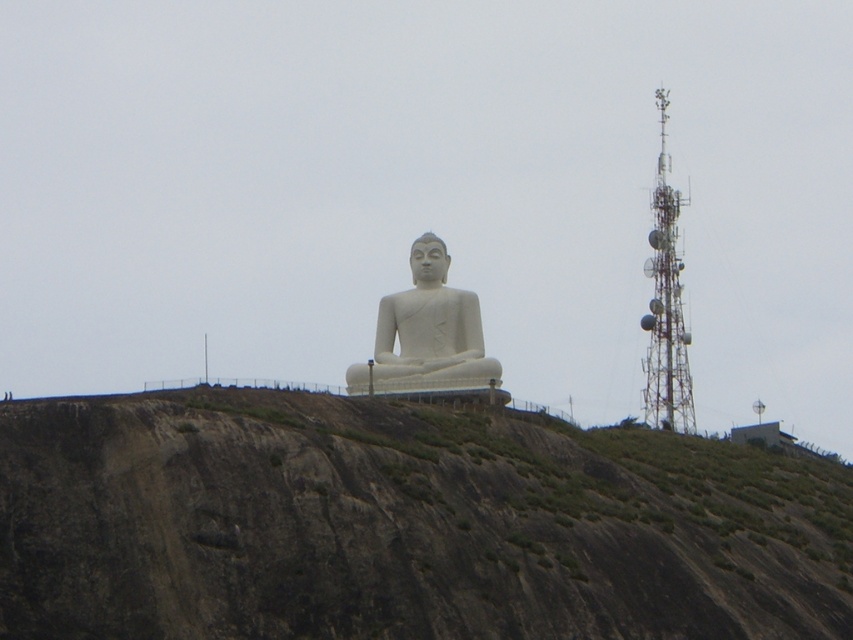
You are a photographer planning to capture the white marble statue at center and the brown rocky hillside at center in a single shot. Based on their positions, which object should you focus on first to ensure both are in frame?

The brown rocky hillside at center is located below the white marble statue at center, so you should focus on the white marble statue at center first to ensure both are in frame.

You are a photographer planning to capture the entire view of the white marble statue at center and the brown rocky hillside at center in a single shot. Given that your camera can only capture objects within a 10 meter width, can both objects fit in the frame?

The brown rocky hillside at center is wider than the white marble statue at center. Since the camera can only capture objects within a 10 meter width, both objects can fit in the frame as long as their combined width does not exceed 10 meters. However, the exact dimensions are not provided, so it depends on their actual widths.

Looking at this image, you are a photographer planning to take a picture of the white marble statue at center and the brown rocky hillside at center. Based on their positions, which object should you focus on first if you want to capture both in a single frame without moving the camera?

The brown rocky hillside at center is positioned on the right side of the white marble statue at center, so you should focus on the white marble statue at center first to ensure both are in frame.